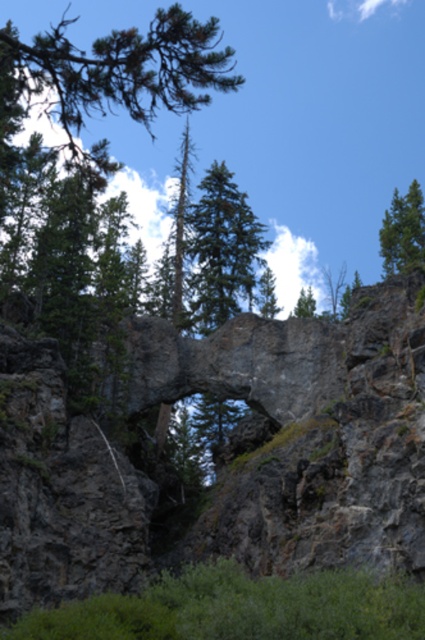
From the picture: You are standing at the base of the rock formation and want to take a photo of the point at coordinates (238,196). If your camera has a maximum zoom range of 150 meters, will you be able to capture that point clearly?

The point at coordinates (238,196) is 165.54 meters away from the camera. Since the camera can only zoom up to 150 meters, it will not be able to capture the point clearly at this distance.

You are an environmental scientist analyzing the rock formation. You notice two trees in the scene. Which tree has a narrower width between the green textured tree at center and the green matte tree at upper right?

The green textured tree at center has a lesser width compared to the green matte tree at upper right, so it is narrower.

You are a hiker who wants to take a photo of the rock formation. You notice two trees in the background that might block your view. Which tree, the green textured tree at center or the green matte tree at upper right, is taller and might block your view more?

The green textured tree at center is much taller than the green matte tree at upper right, so it might block your view more.